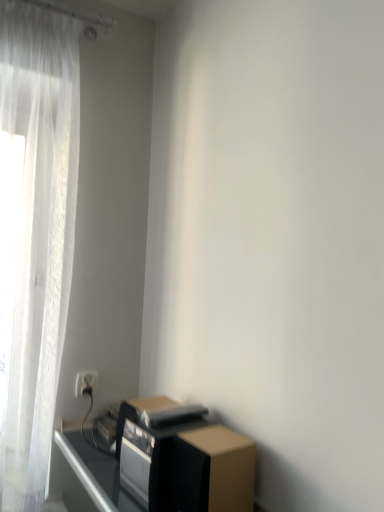
Question: Is black matte speaker at lower right closer to the viewer compared to brown cardboard box at lower right?

Choices:
 (A) yes
 (B) no

Answer: (B)

Question: Is black matte speaker at lower right not inside brown cardboard box at lower right?

Choices:
 (A) no
 (B) yes

Answer: (B)

Question: Considering the relative sizes of black matte speaker at lower right and brown cardboard box at lower right in the image provided, is black matte speaker at lower right bigger than brown cardboard box at lower right?

Choices:
 (A) no
 (B) yes

Answer: (B)

Question: Would you consider black matte speaker at lower right to be distant from brown cardboard box at lower right?

Choices:
 (A) yes
 (B) no

Answer: (B)

Question: Can you confirm if black matte speaker at lower right is taller than brown cardboard box at lower right?

Choices:
 (A) no
 (B) yes

Answer: (A)

Question: Is brown cardboard box at lower right wider or thinner than white plastic electric outlet at lower left?

Choices:
 (A) thin
 (B) wide

Answer: (B)

Question: Is brown cardboard box at lower right bigger or smaller than white plastic electric outlet at lower left?

Choices:
 (A) small
 (B) big

Answer: (B)

Question: Relative to white plastic electric outlet at lower left, is brown cardboard box at lower right in front or behind?

Choices:
 (A) front
 (B) behind

Answer: (A)

Question: Is point (210, 486) positioned closer to the camera than point (97, 372)?

Choices:
 (A) farther
 (B) closer

Answer: (B)

Question: Is black matte speaker at lower right inside the boundaries of brown cardboard box at lower right, or outside?

Choices:
 (A) inside
 (B) outside

Answer: (B)

Question: From a real-world perspective, is black matte speaker at lower right positioned above or below brown cardboard box at lower right?

Choices:
 (A) below
 (B) above

Answer: (A)

Question: Would you say black matte speaker at lower right is to the left or to the right of brown cardboard box at lower right in the picture?

Choices:
 (A) right
 (B) left

Answer: (B)

Question: In the image, is black matte speaker at lower right positioned in front of or behind brown cardboard box at lower right?

Choices:
 (A) behind
 (B) front

Answer: (A)

Question: Considering the relative positions of black matte speaker at lower right and white plastic electric outlet at lower left in the image provided, is black matte speaker at lower right to the left or to the right of white plastic electric outlet at lower left?

Choices:
 (A) left
 (B) right

Answer: (B)

Question: Is black matte speaker at lower right wider or thinner than white plastic electric outlet at lower left?

Choices:
 (A) thin
 (B) wide

Answer: (B)